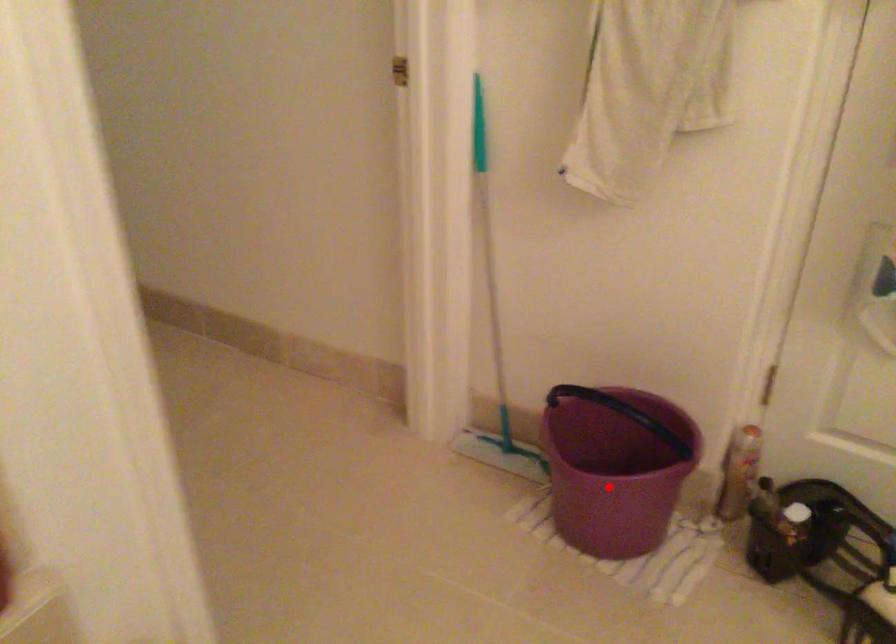
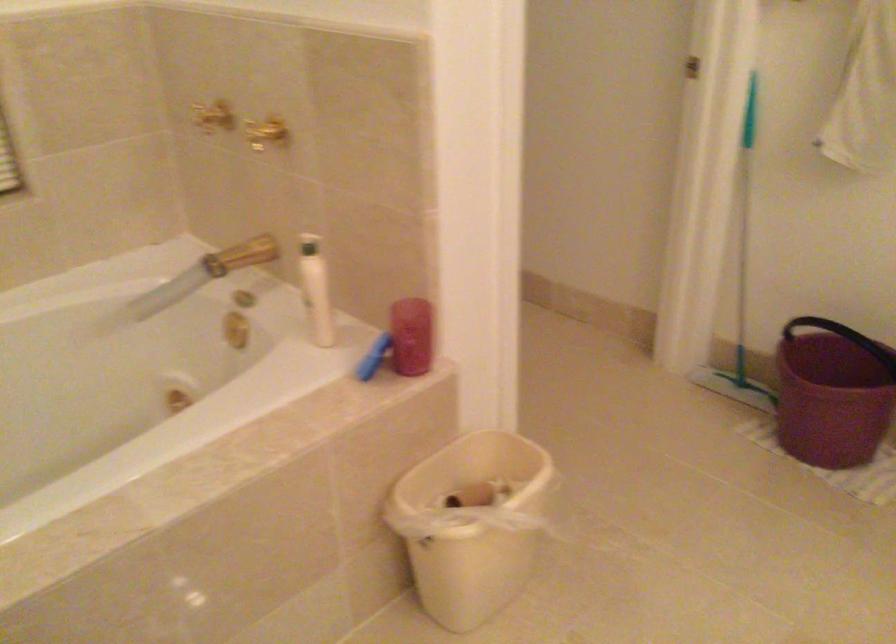
Question: I am providing you with two images of the same scene from different viewpoints. A red point is shown in image1. For the corresponding object point in image2, is it positioned nearer or farther from the camera?

Choices:
 (A) Nearer
 (B) Farther

Answer: (B)